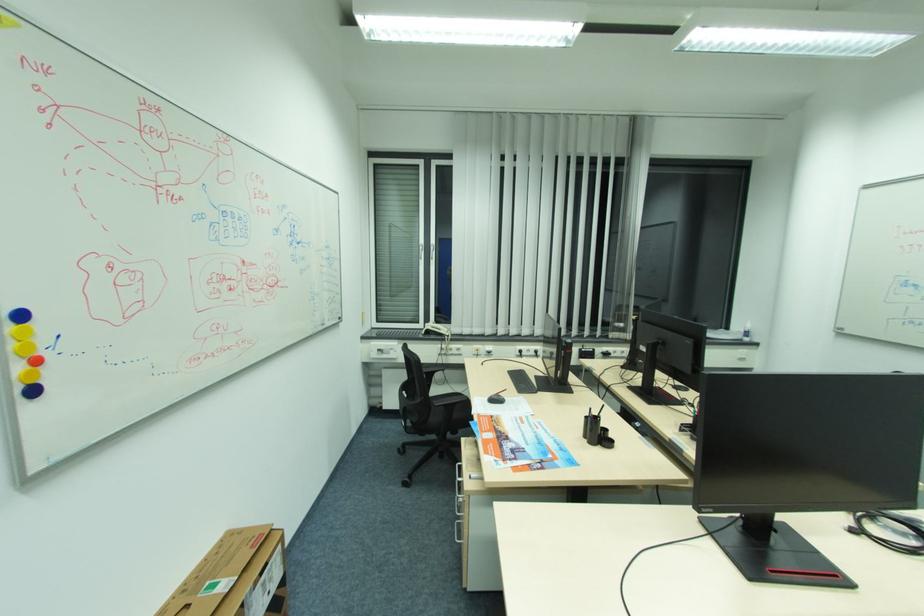
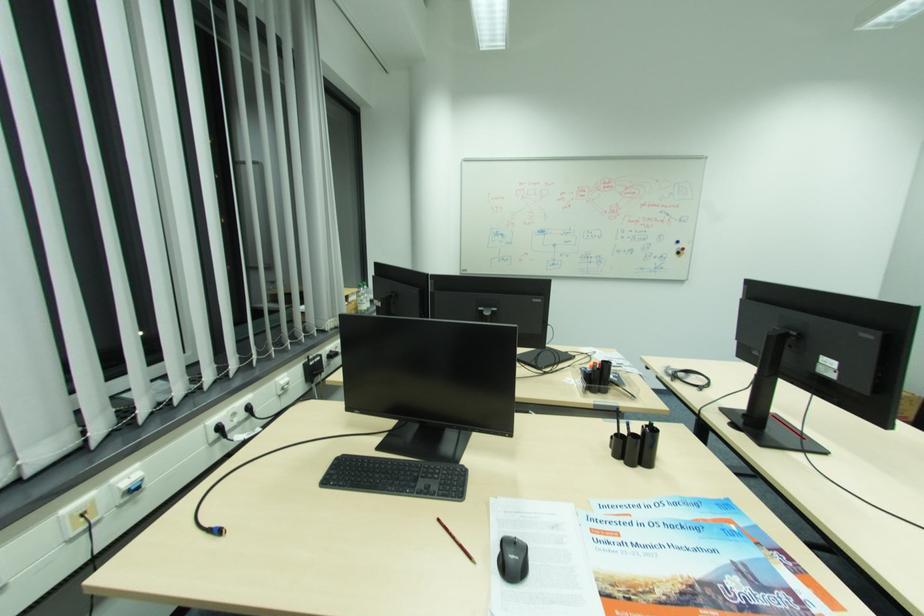
Find the pixel in the second image that matches [524,354] in the first image.

(220, 436)